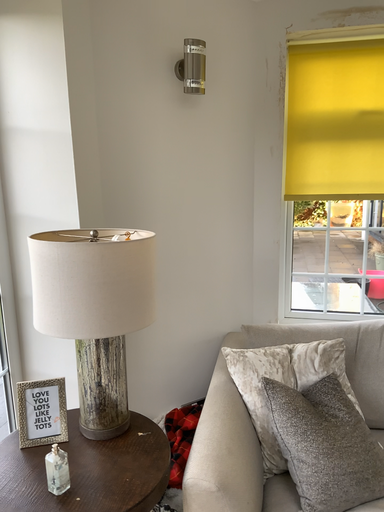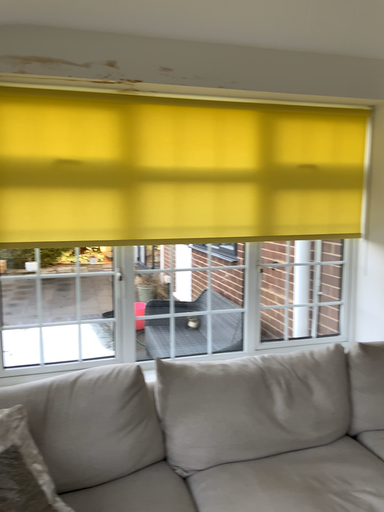
Question: Which way did the camera rotate in the video?

Choices:
 (A) rotated left
 (B) rotated right

Answer: (B)